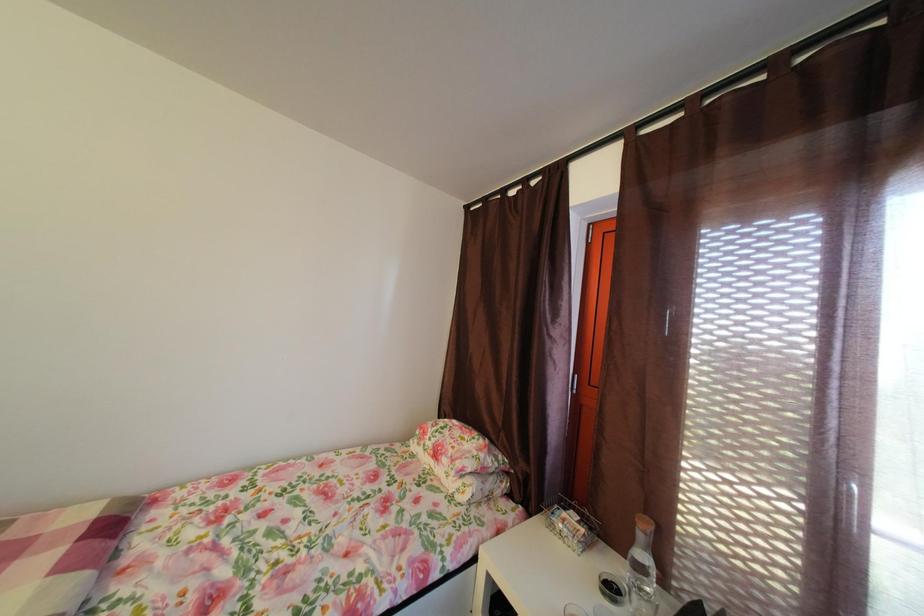
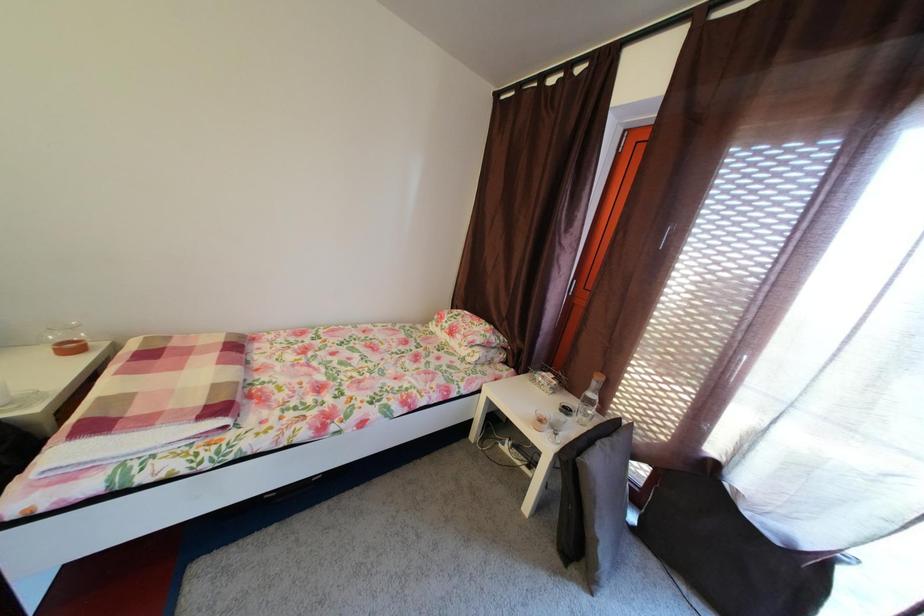
The images are taken continuously from a first-person perspective. In which direction are you moving?

The cameraman moved toward left, backward.